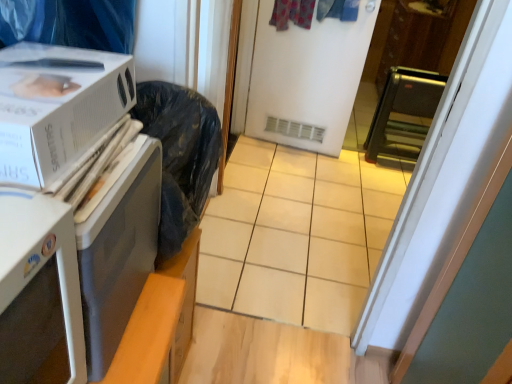
At what (x,y) coordinates should I click in order to perform the action: click on vacant space in white matte screen door at center (from a real-world perspective). Please return your answer as a coordinate pair (x, y). The height and width of the screenshot is (384, 512). Looking at the image, I should click on (285, 144).